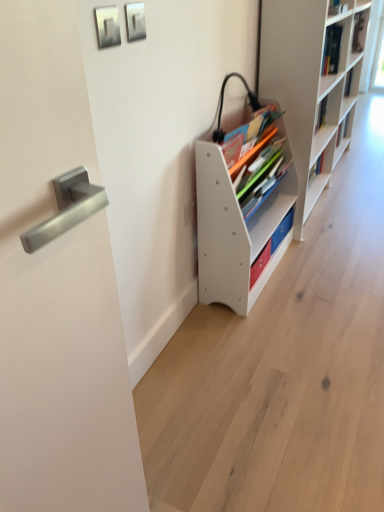
Locate an element on the screen. The height and width of the screenshot is (512, 384). vacant area in front of white matte bookshelf at right, placed as the 1th shelf when sorted from right to left is located at coordinates (334, 245).